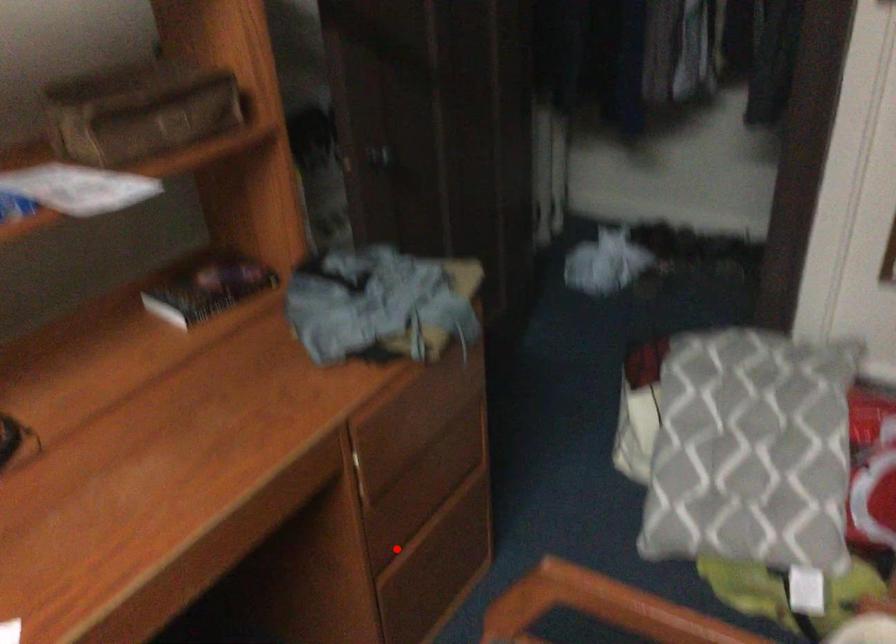
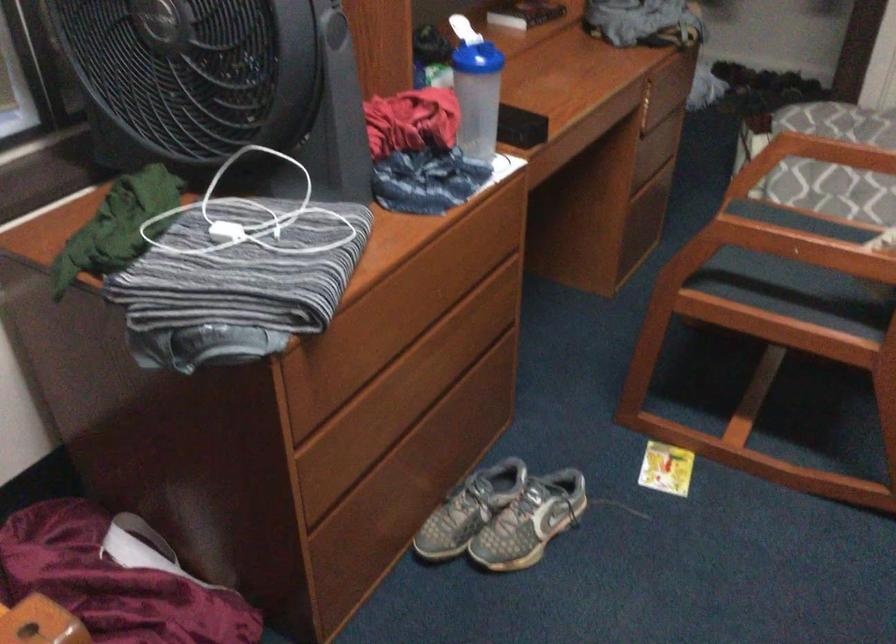
The point at the highlighted location is marked in the first image. Where is the corresponding point in the second image?

(643, 169)